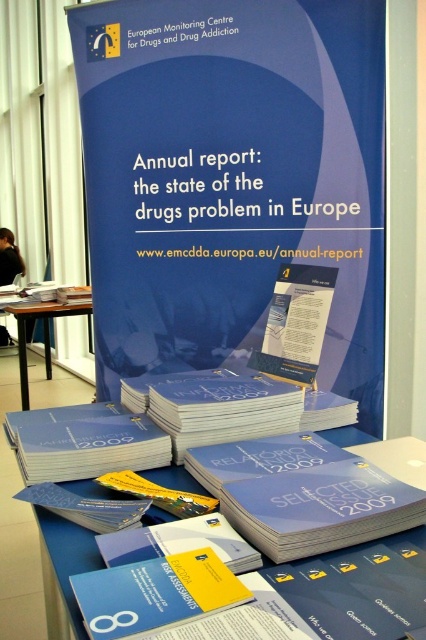
Between blue paper at center and wooden table at lower left, which one appears on the right side from the viewer's perspective?

blue paper at center

What are the coordinates of `blue paper at center` in the screenshot? It's located at (233, 179).

Which of these two, blue paper booklet at center or wooden table at lower left, stands taller?

wooden table at lower left

Is blue paper booklet at center to the left of wooden table at lower left from the viewer's perspective?

Incorrect, blue paper booklet at center is not on the left side of wooden table at lower left.

Where is `blue paper booklet at center`? blue paper booklet at center is located at coordinates (304, 493).

Is blue paper at center wider than blue paper booklet at center?

Correct, the width of blue paper at center exceeds that of blue paper booklet at center.

Which is behind, point (344, 170) or point (256, 544)?

Point (344, 170)

In order to click on blue paper at center in this screenshot , I will do `click(233, 179)`.